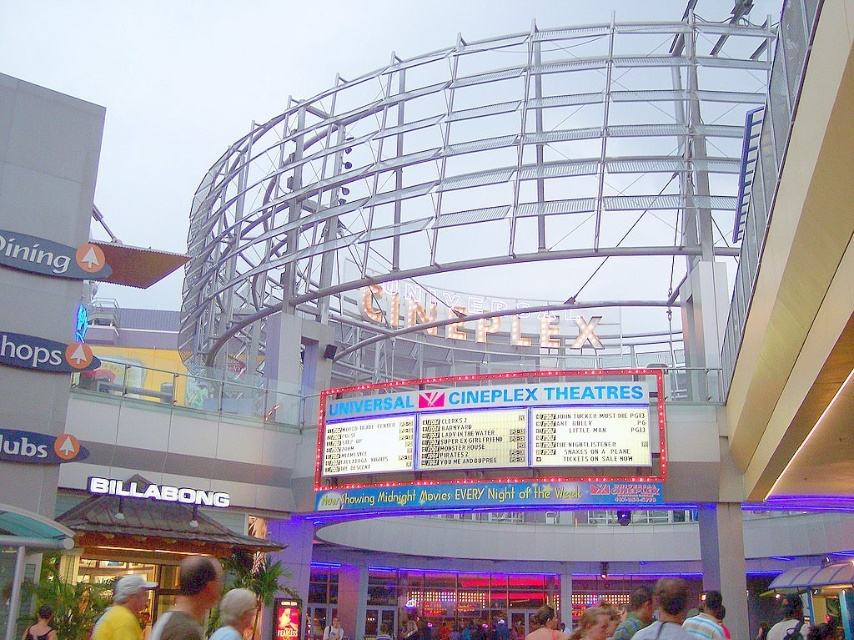
You are standing at the entrance of the Universal Cineplex Theatres and see the red plastic marquee at center and the dark brown hair at lower left. Which object is closer to you?

The red plastic marquee at center is closer to you because it is further to the viewer than the dark brown hair at lower left.

You are a moviegoer standing at the entrance of Universal Cineplex Theatres. You need to check the showtimes on the marquee but notice two people blocking your view. The white hair at center and the matte pink shirt at center are in your way. If you want to move around them, what is the minimum distance you need to walk to ensure you can see the marquee clearly?

The minimum distance you need to walk is 25.87 meters, which is the distance between the white hair at center and the matte pink shirt at center. By moving at least this distance away from both individuals, you can ensure an unobstructed view of the marquee.

You are standing at the entrance of the Universal Cineplex Theatres and see two points marked on the marquee. The first point is at coordinate point [541,637] and the second is at point [44,627]. Which point is closer to you?

Point [44,627] is closer to you because it is in front of point [541,637].